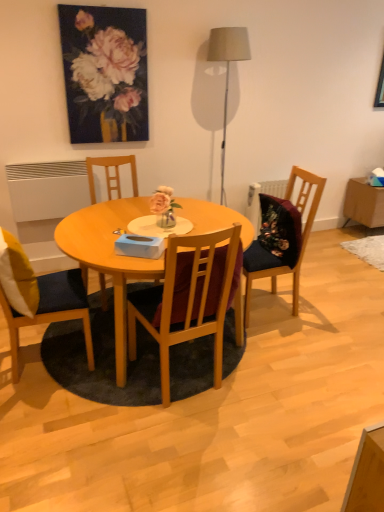
In order to click on free spot below dark blue fabric chair at center, the fourth chair viewed from the left (from a real-world perspective) in this screenshot , I will do `click(270, 304)`.